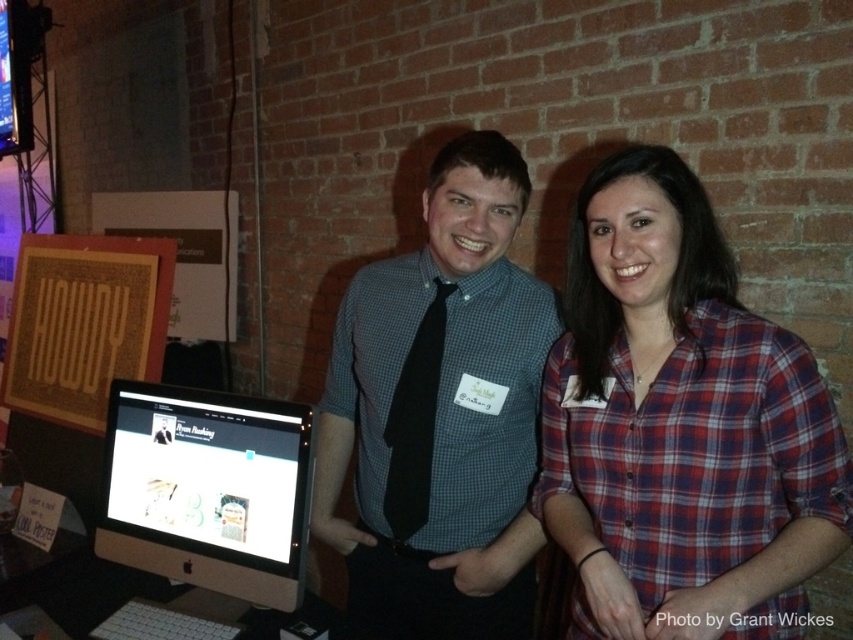
Who is lower down, checkered fabric shirt at center or satin black monitor at center?

satin black monitor at center

Is point (355, 385) positioned in front of point (216, 573)?

That is False.

Which is behind, point (366, 460) or point (223, 477)?

The point (366, 460) is more distant.

The height and width of the screenshot is (640, 853). What are the coordinates of `checkered fabric shirt at center` in the screenshot? It's located at (440, 413).

Does plaid cotton shirt at center have a greater width compared to checkered fabric shirt at center?

Incorrect, plaid cotton shirt at center's width does not surpass checkered fabric shirt at center's.

Between plaid cotton shirt at center and checkered fabric shirt at center, which one appears on the left side from the viewer's perspective?

From the viewer's perspective, checkered fabric shirt at center appears more on the left side.

Does point (715, 499) come farther from viewer compared to point (412, 371)?

No.

You are a GUI agent. You are given a task and a screenshot of the screen. Output one action in this format:
    pyautogui.click(x=<x>, y=<y>)
    Task: Click on the plaid cotton shirt at center
    
    Given the screenshot: What is the action you would take?
    pyautogui.click(x=682, y=426)

Which is more to the left, plaid cotton shirt at center or satin black monitor at center?

satin black monitor at center is more to the left.

Can you confirm if plaid cotton shirt at center is shorter than satin black monitor at center?

In fact, plaid cotton shirt at center may be taller than satin black monitor at center.

Between point (595, 401) and point (254, 540), which one is positioned in front?

Positioned in front is point (595, 401).

Image resolution: width=853 pixels, height=640 pixels. I want to click on plaid cotton shirt at center, so click(682, 426).